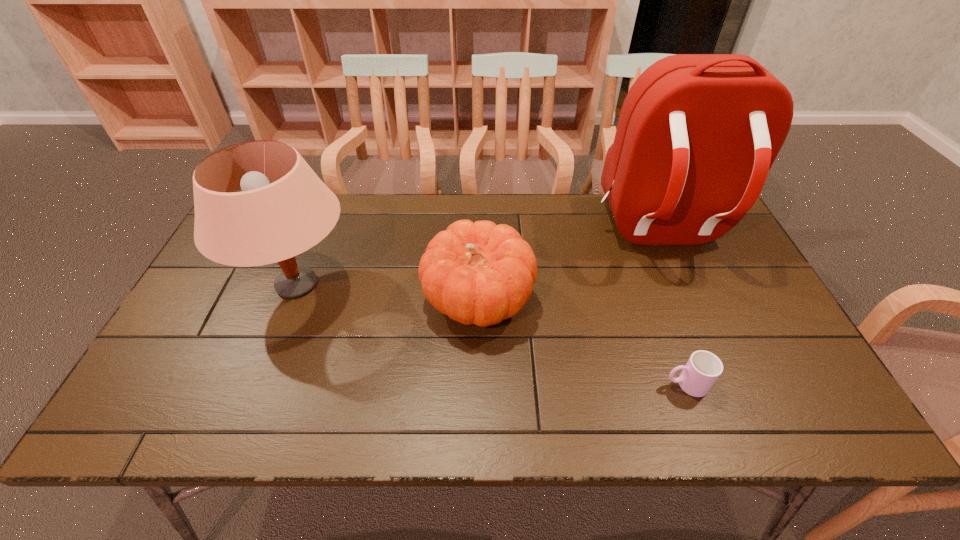
You are a GUI agent. You are given a task and a screenshot of the screen. Output one action in this format:
    pyautogui.click(x=<x>, y=<y>)
    Task: Click on the free spot that satisfies the following two spatial constraints: 1. on the front-facing side of the lampshade; 2. with the handle on the side of the shortest object
    The width and height of the screenshot is (960, 540).
    Given the screenshot: What is the action you would take?
    pyautogui.click(x=258, y=384)

Identify the location of free spot that satisfies the following two spatial constraints: 1. with the handle on the side of the cup; 2. on the front side of the second object from left to right. (656, 300).